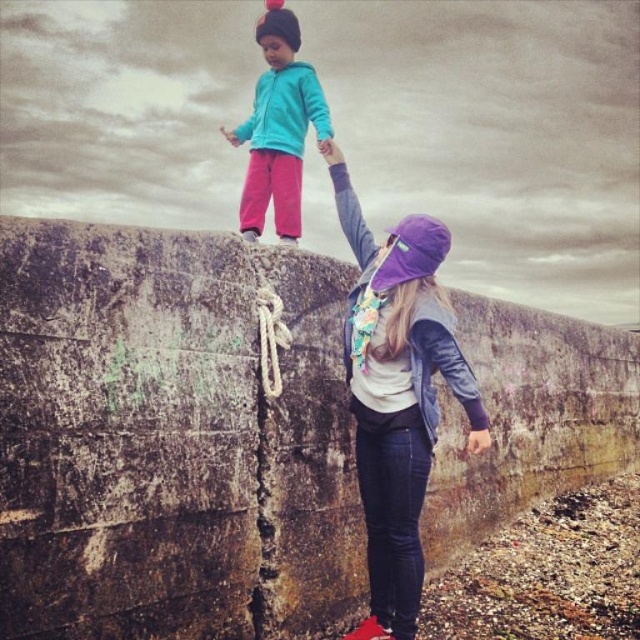
You are a painter trying to place a new decorative item on the rusty concrete wall at upper center. The item you have is exactly the same size as the purple fabric hat at upper center. Will the wall have enough space to accommodate this item without overlapping the hat?

The rusty concrete wall at upper center is wider than the purple fabric hat at upper center, so yes, the wall has enough space to place the item without overlapping the hat since its width is greater than the hat.

You are a hiker trying to climb the stone wall. You see the turquoise fleece jacket at upper center and the white woven rope at center. Which object is closer to you as you attempt to climb?

The turquoise fleece jacket at upper center is closer to you because it is further to the viewer than the white woven rope at center.

From the picture: You are a painter who needs to paint the rusty concrete wall at upper center and the purple fabric hat at upper center. Which object should you paint first if you want to start with the one that is closer to the ground?

The rusty concrete wall at upper center is positioned under the purple fabric hat at upper center, so it is closer to the ground. Therefore, you should paint the rusty concrete wall at upper center first.